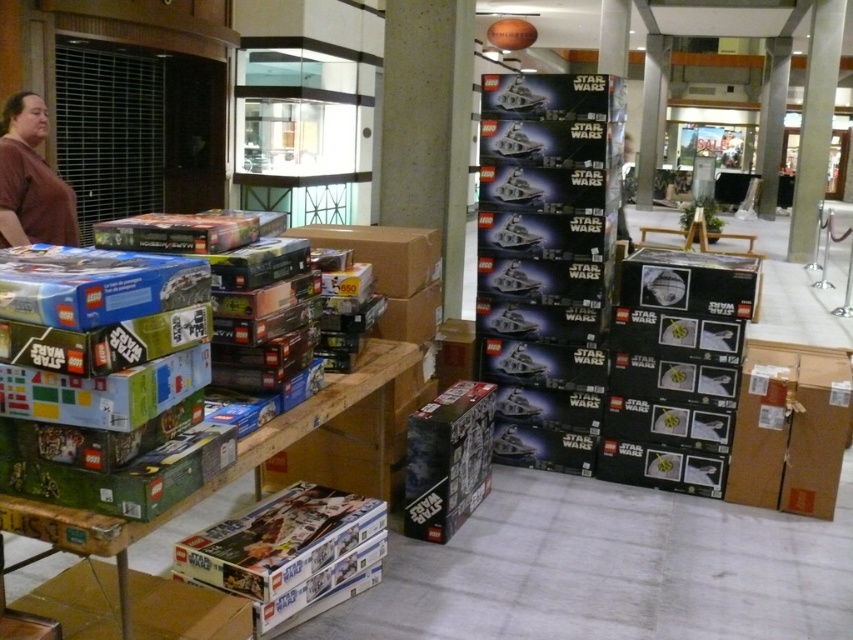
You are standing in the LEGO Star Wars section of the store. You see two points marked on the floor, one at point (776,461) and the other at point (15,218). Which point is closer to you?

Point (776,461) is in front of point (15,218), so it is closer to you.

You are an employee organizing the LEGO Star Wars section. You need to place the brown cardboard box at lower right and the brown matte shirt at left onto a shelf that can only accommodate items with a combined width of 50 cm. If the shirt is 20 cm wide, will both items fit together on the shelf?

The brown cardboard box at lower right has a larger width than the brown matte shirt at left. Since the shirt is 20 cm wide, the box must be wider than 20 cm. Adding their widths together would exceed 50 cm, so they cannot fit together on the shelf.